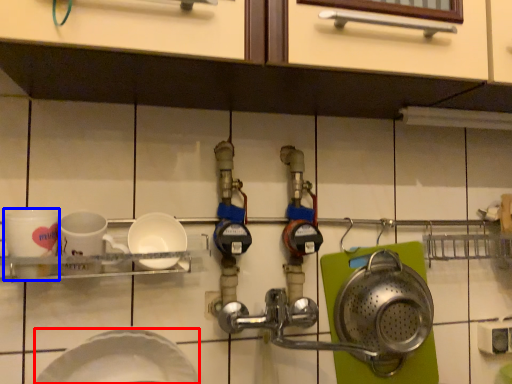
Question: Which point is further to the camera, plate (highlighted by a red box) or coffee cup (highlighted by a blue box)?

Choices:
 (A) plate
 (B) coffee cup

Answer: (B)